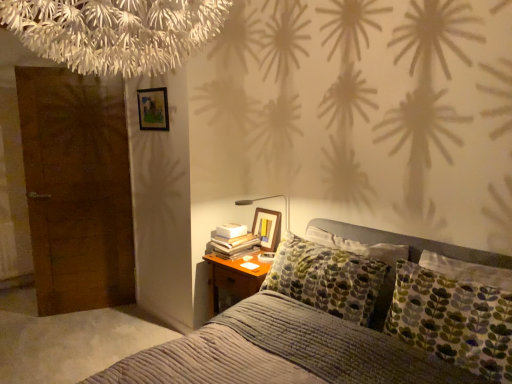
Question: Does point (154, 99) appear closer or farther from the camera than point (263, 220)?

Choices:
 (A) farther
 (B) closer

Answer: (B)

Question: Is wooden picture frame at upper left, placed as the 1th picture frame when sorted from left to right, in front of or behind wooden picture frame at upper right, placed as the second picture frame when sorted from top to bottom, in the image?

Choices:
 (A) front
 (B) behind

Answer: (A)

Question: Considering the real-world distances, which object is closest to the wooden picture frame at upper left, placed as the 1th picture frame when sorted from left to right?

Choices:
 (A) white paper book at bedside
 (B) white fringed chandelier at upper center
 (C) wooden picture frame at upper right, which is the 1th picture frame from right to left
 (D) textured gray bed at center
 (E) brown wooden door at left

Answer: (E)

Question: Which object is the farthest from the textured gray bed at center?

Choices:
 (A) wooden picture frame at upper right, arranged as the second picture frame when viewed from the left
 (B) brown wooden door at left
 (C) wooden picture frame at upper left, which appears as the first picture frame when viewed from the top
 (D) white fringed chandelier at upper center
 (E) white paper book at bedside

Answer: (B)